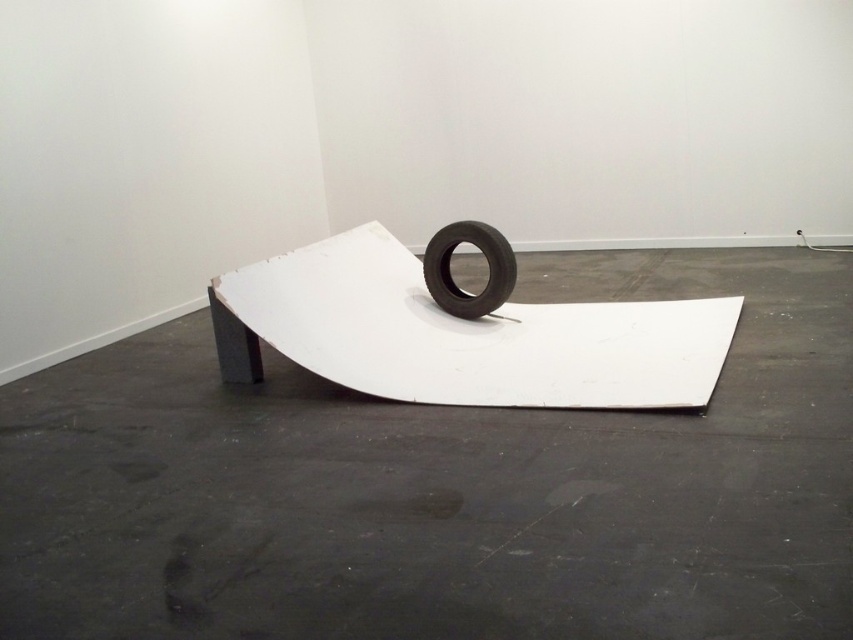
Question: Which object is closer to the camera taking this photo?

Choices:
 (A) black rubber tire at center
 (B) white matte ramp at center

Answer: (B)

Question: Is white matte ramp at center wider than black rubber tire at center?

Choices:
 (A) no
 (B) yes

Answer: (B)

Question: Which point is farther to the camera?

Choices:
 (A) (462, 237)
 (B) (433, 394)

Answer: (A)

Question: In this image, where is white matte ramp at center located relative to black rubber tire at center?

Choices:
 (A) right
 (B) left

Answer: (A)

Question: Does white matte ramp at center lie in front of black rubber tire at center?

Choices:
 (A) yes
 (B) no

Answer: (A)